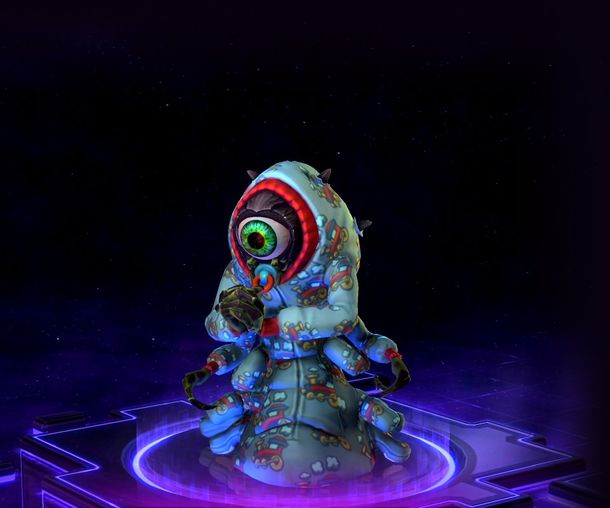
The height and width of the screenshot is (508, 610). Identify the location of violet light. click(276, 497).